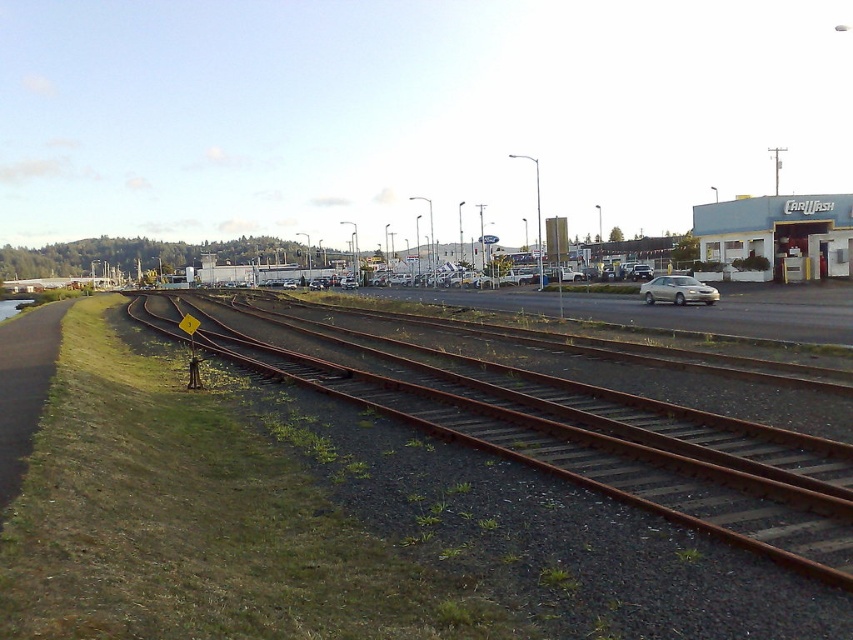
Which is in front, point (822, 525) or point (712, 298)?

Point (822, 525)

Which is more to the right, rusty metal tracks at lower left or silver metallic sedan at center-right?

silver metallic sedan at center-right is more to the right.

Between point (767, 509) and point (689, 296), which one is positioned in front?

Point (767, 509) is more forward.

Locate an element on the screen. The height and width of the screenshot is (640, 853). rusty metal tracks at lower left is located at coordinates (573, 435).